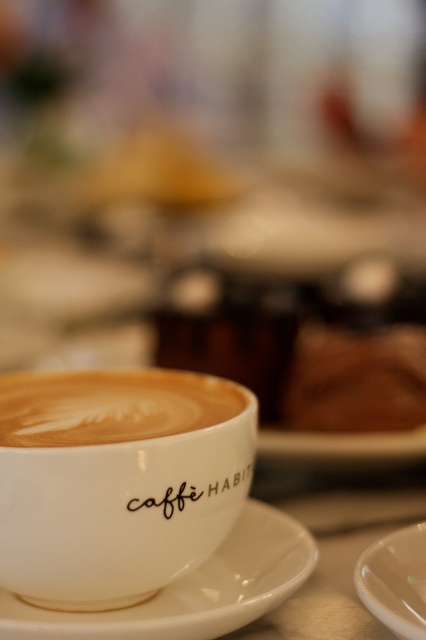
You are a barista trying to place a new latte art design on the white ceramic cup. The design requires precise placement between the white ceramic saucer at center and the black matte text at center. Given the distance between them is 4.56 inches, will the design fit if it needs a minimum of 5 inches of space?

The distance between the white ceramic saucer at center and the black matte text at center is 4.56 inches, which is less than the required 5 inches. Therefore, the design will not fit.

Based on the photo, you are a barista trying to place a small saucer under a latte cup without spilling. The white matte cup at center contains the latte, and the white glossy plate at lower right is the saucer. Given that the distance between them is 8.21 inches, is this distance sufficient for you to carefully move the cup to the plate without spilling the drink?

The white matte cup at center is 8.21 inches from the white glossy plate at lower right. Since this distance is manageable for careful handling, the barista can move the cup to the plate without spilling the drink.

You are a barista trying to place a new cup on the table. The white ceramic saucer at center is located at point [192,589]. Where should you place the new cup to ensure it is centered on the saucer?

The new cup should be placed at point [192,589] to ensure it is centered on the white ceramic saucer at center.